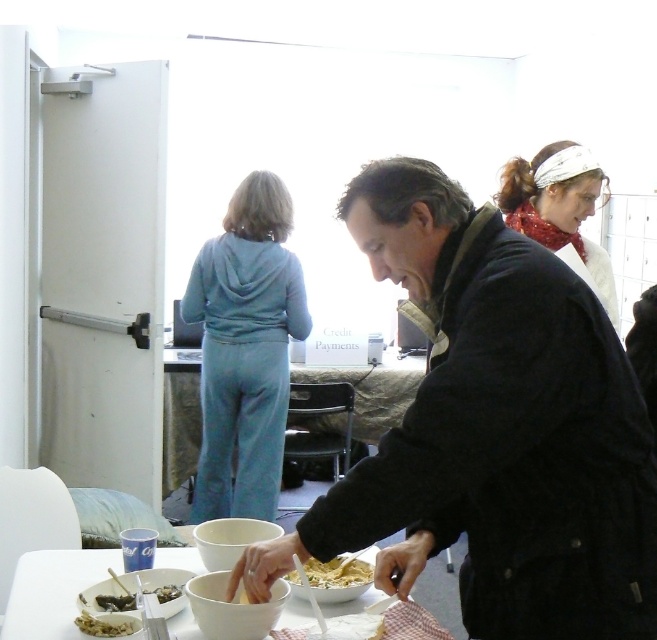
You are standing in the room and want to reach both the point at location (348, 564) and the point at (125, 625). Which point will you reach first?

You will reach point (348, 564) first because it is closer to you than point (125, 625), which is further away.

You are a guest at a party and need to choose between wearing the dark blue jacket at center or using the shiny metallic spoon at lower left. Based on their sizes, which one is more suitable for its intended purpose?

The dark blue jacket at center is larger in size than the shiny metallic spoon at lower left, so it is more suitable for wearing as a jacket, while the spoon is appropriately sized for its use.